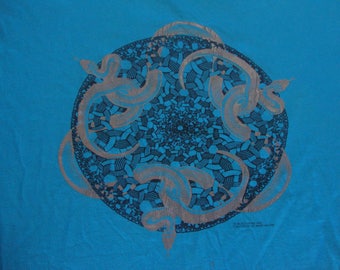
Find the location of a particular element. The image size is (340, 270). grey half circle that looks like a handle is located at coordinates (277, 199), (61, 172), (190, 24).